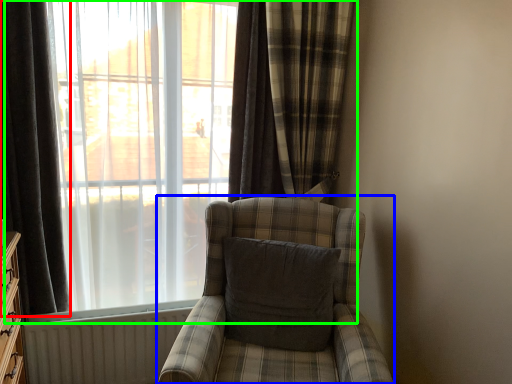
Question: Which object is the farthest from curtain (highlighted by a red box)? Choose among these: chair (highlighted by a blue box) or window (highlighted by a green box).

Choices:
 (A) chair
 (B) window

Answer: (A)